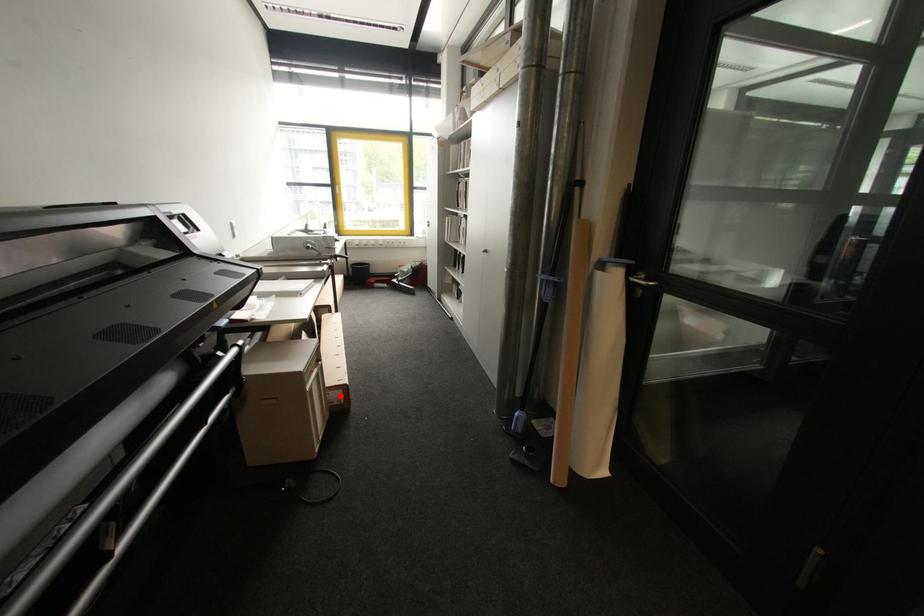
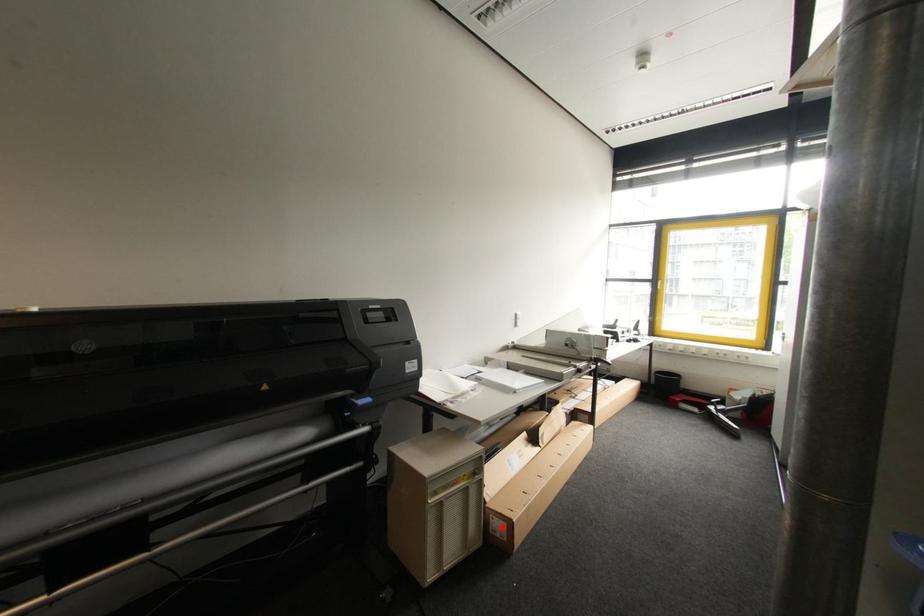
I am providing you with two images of the same scene from different viewpoints. A red point is marked on the first image and another point is marked on the second image. Is the marked point in image1 the same physical position as the marked point in image2?

Yes